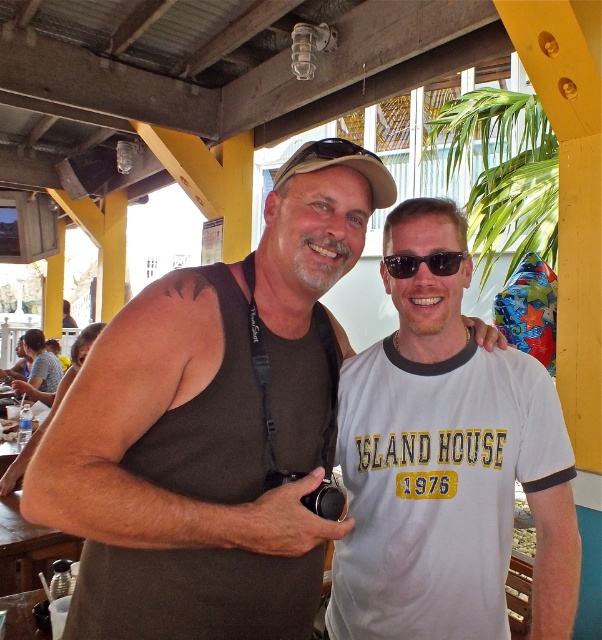
You are a photographer trying to decide which tank top to wear for a photoshoot. You need to choose between the brown matte tank top at center and the brown fabric tank top at left. Based on their sizes, which one would be more suitable if you want a more oversized look?

The brown matte tank top at center is larger in size compared to the brown fabric tank top at left, making it more suitable for an oversized look.